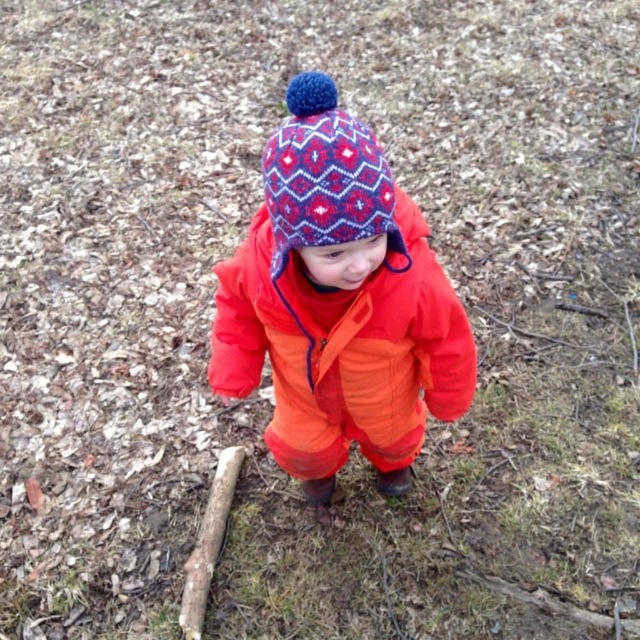
Can you confirm if matte orange snowsuit at center is positioned to the right of knitted woolen hat at center?

Yes, matte orange snowsuit at center is to the right of knitted woolen hat at center.

Consider the image. Can you confirm if matte orange snowsuit at center is bigger than knitted woolen hat at center?

Indeed, matte orange snowsuit at center has a larger size compared to knitted woolen hat at center.

Is point (326, 113) positioned in front of point (368, 145)?

No, it is behind (368, 145).

Locate an element on the screen. This screenshot has width=640, height=640. matte orange snowsuit at center is located at coordinates (339, 305).